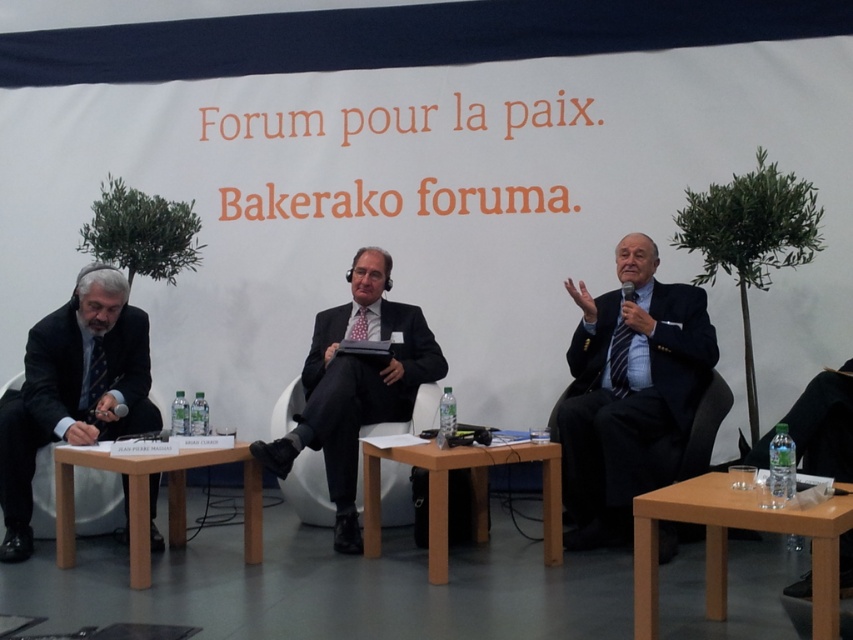
Question: Which point is farther to the camera?

Choices:
 (A) light brown wood table at center
 (B) black matte suit at center

Answer: (B)

Question: Does dark blue textured suit at center appear on the left side of light brown wooden table at center?

Choices:
 (A) no
 (B) yes

Answer: (A)

Question: Is dark blue textured suit at center thinner than black matte suit at center?

Choices:
 (A) no
 (B) yes

Answer: (B)

Question: Does dark blue wool suit at left appear under light brown wooden table at center?

Choices:
 (A) yes
 (B) no

Answer: (B)

Question: Which point is farther to the camera?

Choices:
 (A) light brown wooden table at center
 (B) light brown wooden table at lower right
 (C) dark blue wool suit at left

Answer: (C)

Question: Which of the following is the closest to the observer?

Choices:
 (A) dark blue textured suit at center
 (B) dark blue wool suit at left
 (C) light brown wooden table at lower right
 (D) light brown wooden table at center

Answer: (C)